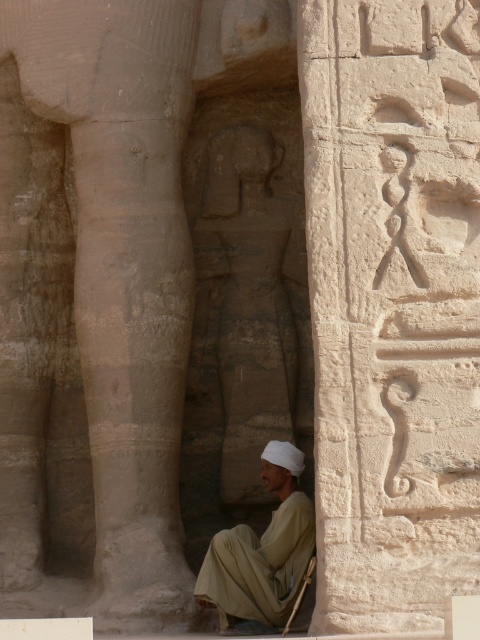
You are an archaeologist examining the ancient Egyptian temple. You notice two points marked on your map at coordinates point (397, 61) and point (252, 326). Which point is closer to you when standing at the entrance of the temple?

Point (397, 61) is in front of point (252, 326), so it is closer to you when standing at the entrance of the temple.

You are an archaeologist examining the ancient Egyptian temple. You notice two points marked in the scene. Which point is nearer to you, point [470,90] or point [284,460]?

Point [470,90] is closer to the viewer than point [284,460].

You are an archaeologist examining the ancient Egyptian temple. You notice the smooth stone hieroglyphs at center and the gray stone statue at center. Which one is positioned higher up in the scene?

The smooth stone hieroglyphs at center are positioned higher up in the scene as they are located above the gray stone statue at center.